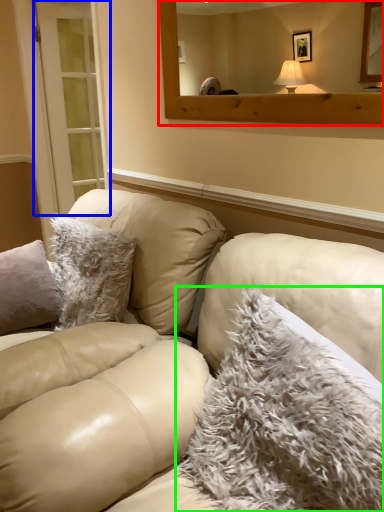
Question: Which object is the farthest from mirror (highlighted by a red box)? Choose among these: glass door (highlighted by a blue box) or pillow (highlighted by a green box).

Choices:
 (A) glass door
 (B) pillow

Answer: (A)